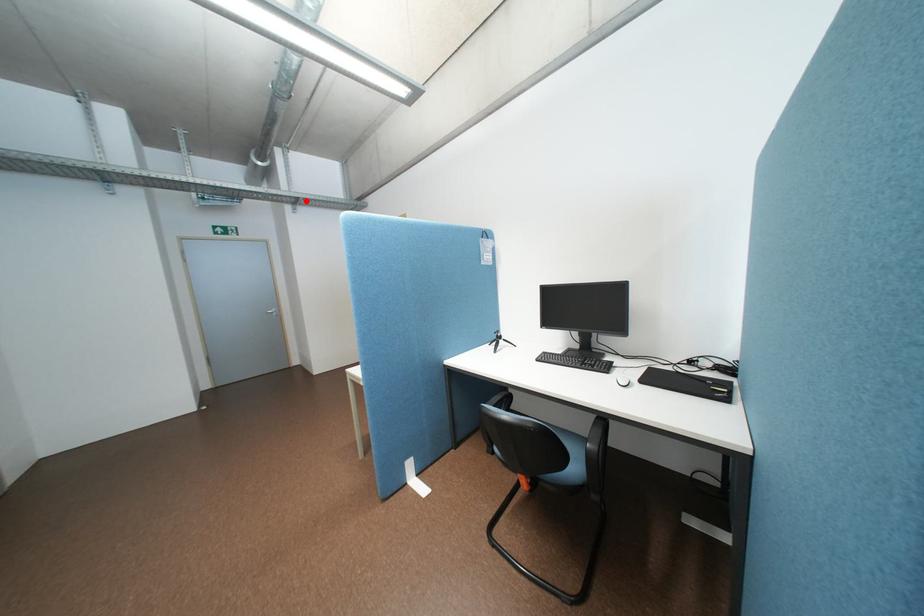
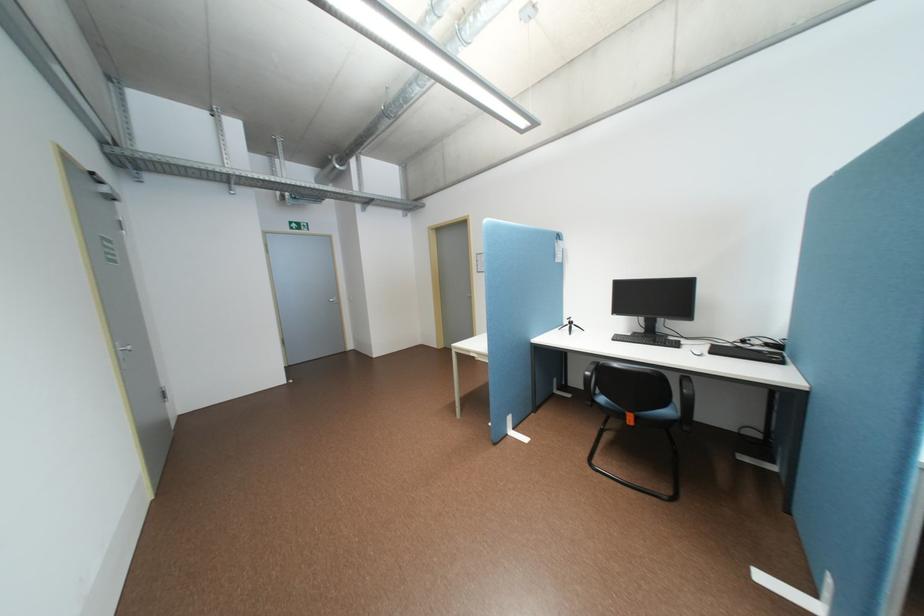
Question: I am providing you with two images of the same scene from different viewpoints. A red point is shown in image1. For the corresponding object point in image2, is it positioned nearer or farther from the camera?

Choices:
 (A) Nearer
 (B) Farther

Answer: (B)